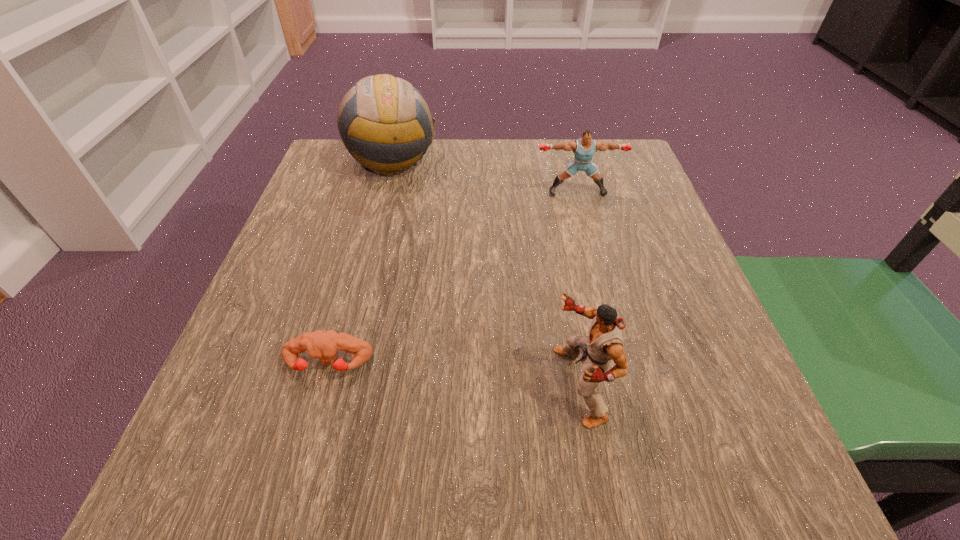
Where is `blank area in the image that satisfies the following two spatial constraints: 1. on the front-facing side of the second shortest object; 2. on the front-facing side of the tallest puncher`? blank area in the image that satisfies the following two spatial constraints: 1. on the front-facing side of the second shortest object; 2. on the front-facing side of the tallest puncher is located at coordinates (628, 386).

Identify the location of vacant space that satisfies the following two spatial constraints: 1. on the front-facing side of the farthest puncher; 2. on the front-facing side of the tallest puncher. The width and height of the screenshot is (960, 540). (628, 386).